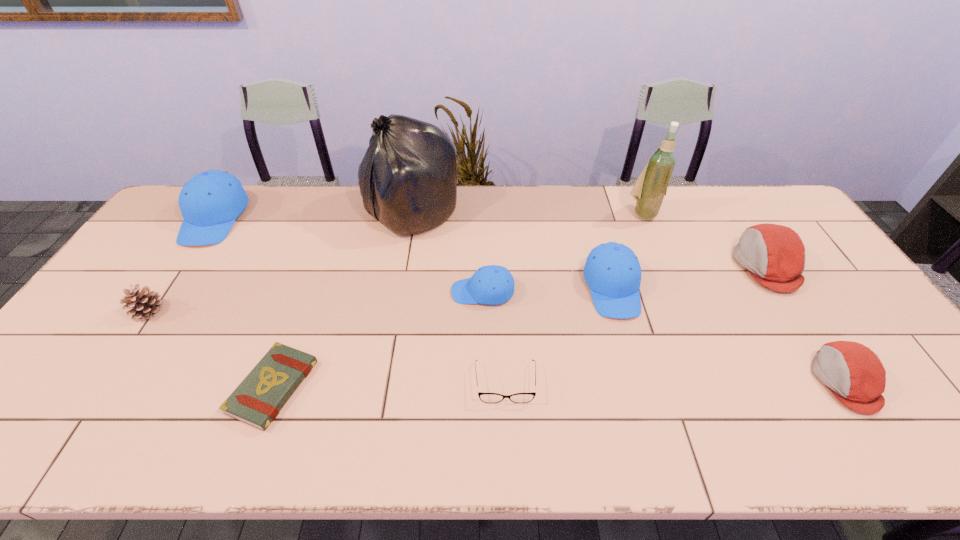
The height and width of the screenshot is (540, 960). Find the location of `the nearest cap`. the nearest cap is located at coordinates (855, 375).

The image size is (960, 540). Identify the location of the smaller red cap. (855, 375).

Where is `the ninth tallest object`? The image size is (960, 540). the ninth tallest object is located at coordinates (484, 397).

This screenshot has width=960, height=540. I want to click on the third object from left to right, so coord(258,399).

You are a GUI agent. You are given a task and a screenshot of the screen. Output one action in this format:
    pyautogui.click(x=<x>, y=<y>)
    Task: Click on the shortest object
    This screenshot has width=960, height=540.
    Given the screenshot: What is the action you would take?
    pyautogui.click(x=258, y=399)

Locate an element on the screen. Image resolution: width=960 pixels, height=540 pixels. vacant region located 0.290m on the front of the plastic bag is located at coordinates (394, 313).

The image size is (960, 540). Identify the location of vacant space located on the front-facing side of the wine bottle. (656, 244).

This screenshot has height=540, width=960. Identify the location of vacant space located on the front-facing side of the farthest blue cap. (154, 310).

Where is `blank space located 0.320m on the front-facing side of the rightmost blue cap`? This screenshot has width=960, height=540. blank space located 0.320m on the front-facing side of the rightmost blue cap is located at coordinates (654, 436).

Where is `vacant point located 0.180m on the front-facing side of the farther red cap`? This screenshot has height=540, width=960. vacant point located 0.180m on the front-facing side of the farther red cap is located at coordinates (676, 266).